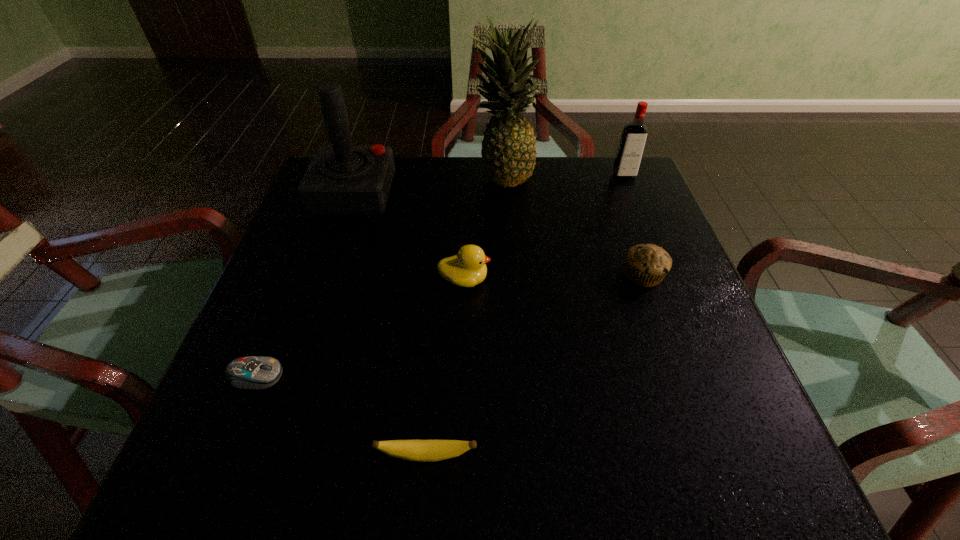
Where is `joystick located at the left edge`? joystick located at the left edge is located at coordinates (342, 179).

Locate an element on the screen. This screenshot has width=960, height=540. computer mouse at the left edge is located at coordinates (248, 372).

The width and height of the screenshot is (960, 540). What are the coordinates of `vodka situated at the right edge` in the screenshot? It's located at (633, 139).

Find the location of a particular element. muffin that is at the right edge is located at coordinates (646, 265).

Locate an element on the screen. The height and width of the screenshot is (540, 960). object positioned at the far left corner is located at coordinates pyautogui.click(x=342, y=179).

Find the location of a particular element. object located in the far right corner section of the desktop is located at coordinates (633, 139).

Image resolution: width=960 pixels, height=540 pixels. Find the location of `free region at the far edge of the desktop`. free region at the far edge of the desktop is located at coordinates (415, 160).

You are a GUI agent. You are given a task and a screenshot of the screen. Output one action in this format:
    pyautogui.click(x=<x>, y=<y>)
    Task: Click on the vacant space at the near edge
    This screenshot has height=540, width=960.
    Given the screenshot: What is the action you would take?
    pyautogui.click(x=487, y=449)

Locate an element on the screen. vacant area at the left edge is located at coordinates pos(326,235).

What are the coordinates of `free location at the right edge` in the screenshot? It's located at (611, 220).